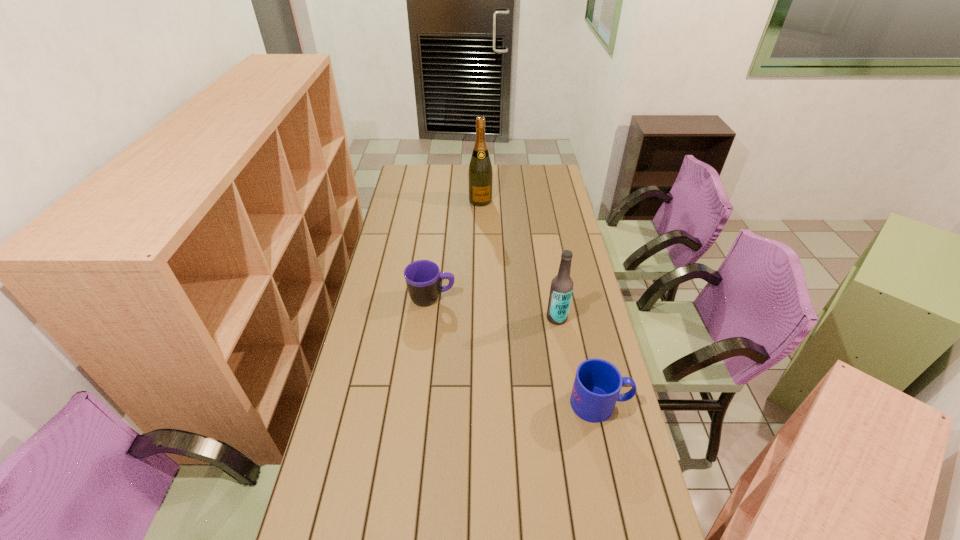
This screenshot has height=540, width=960. What are the coordinates of `vacant point located between the second tallest object and the right mug` in the screenshot? It's located at (579, 361).

Find the location of `the closest object to the nearer mug`. the closest object to the nearer mug is located at coordinates (561, 289).

At what (x,y) coordinates should I click in order to perform the action: click on the closest object to the third object from right to left. Please return your answer as a coordinate pair (x, y). The image size is (960, 540). Looking at the image, I should click on (423, 278).

Image resolution: width=960 pixels, height=540 pixels. Identify the location of vacant space that satisfies the following two spatial constraints: 1. on the front side of the farthest object; 2. on the right side of the beer bottle. (481, 318).

Locate an element on the screen. This screenshot has width=960, height=540. vacant area that satisfies the following two spatial constraints: 1. on the front side of the nearest object; 2. on the side with the handle of the second tallest object is located at coordinates (572, 403).

This screenshot has width=960, height=540. In order to click on vacant region that satisfies the following two spatial constraints: 1. on the front side of the beer bottle; 2. on the left side of the second object from left to right in this screenshot , I will do `click(481, 318)`.